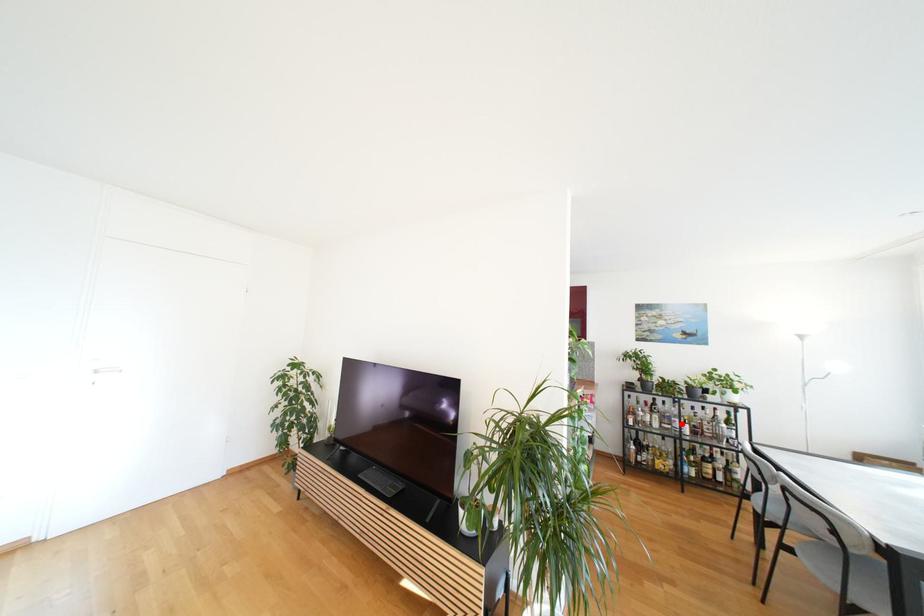
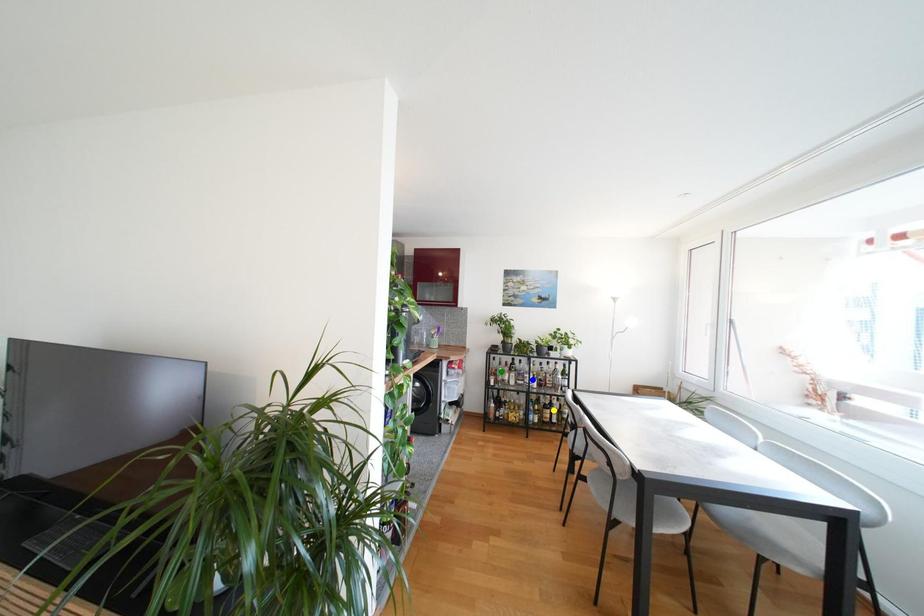
Question: I am providing you with two images of the same scene from different viewpoints. A red point is marked on the first image. You are given multiple points on the second image. Can you choose the point in image 2 that corresponds to the point in image 1?

Choices:
 (A) yellow point
 (B) green point
 (C) blue point

Answer: (C)